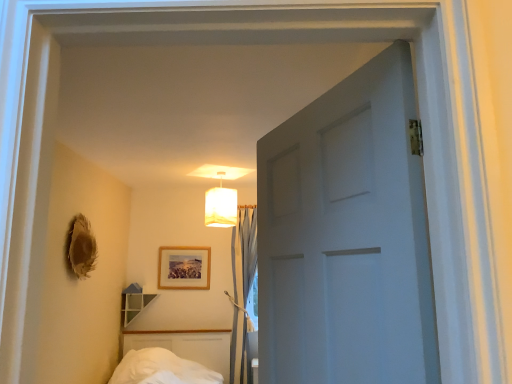
Question: Is light blue fabric curtain at center spatially inside white fabric lampshade at upper center, or outside of it?

Choices:
 (A) inside
 (B) outside

Answer: (B)

Question: From the image's perspective, is light blue fabric curtain at center located above or below white fabric lampshade at upper center?

Choices:
 (A) above
 (B) below

Answer: (B)

Question: Which of these objects is positioned farthest from the light blue fabric curtain at center?

Choices:
 (A) white fabric lampshade at upper center
 (B) wooden picture frame at center

Answer: (A)

Question: Based on their relative distances, which object is nearer to the wooden picture frame at center?

Choices:
 (A) light blue fabric curtain at center
 (B) white fabric lampshade at upper center

Answer: (A)